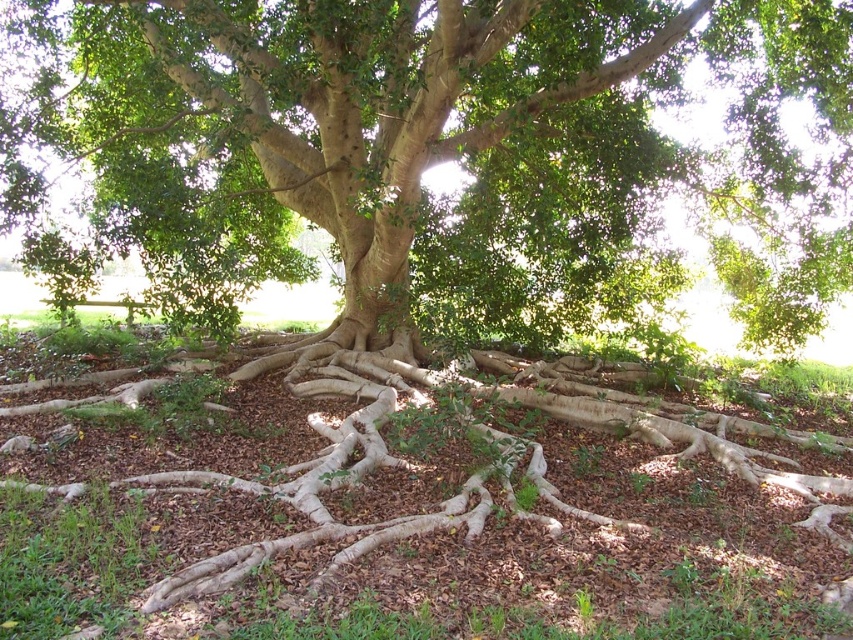
Can you confirm if green matte tree at center is smaller than brown mulch at center?

No, green matte tree at center is not smaller than brown mulch at center.

Where is `green matte tree at center`? The height and width of the screenshot is (640, 853). green matte tree at center is located at coordinates (426, 148).